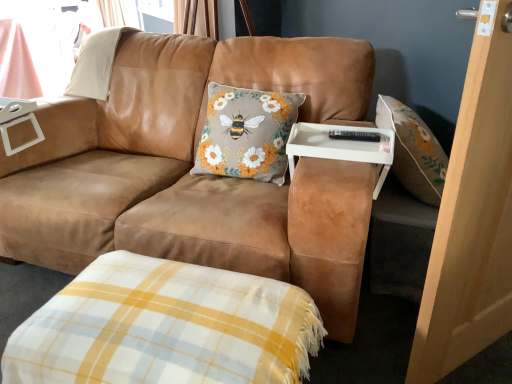
Locate an element on the screen. empty space that is ontop of yellow and white plaid blanket at lower center (from a real-world perspective) is located at coordinates (158, 315).